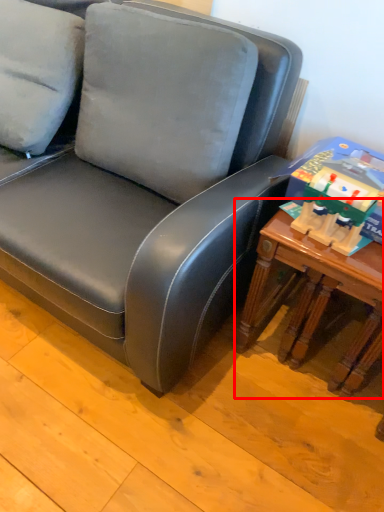
Question: Observing the image, what is the correct spatial positioning of table (annotated by the red box) in reference to toy?

Choices:
 (A) left
 (B) right

Answer: (B)